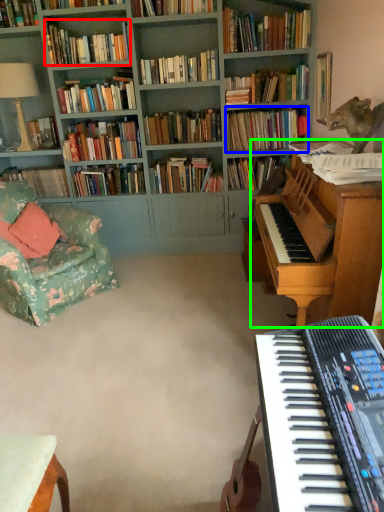
Question: Which object is positioned farthest from book (highlighted by a red box)? Select from book (highlighted by a blue box) and piano (highlighted by a green box).

Choices:
 (A) book
 (B) piano

Answer: (B)